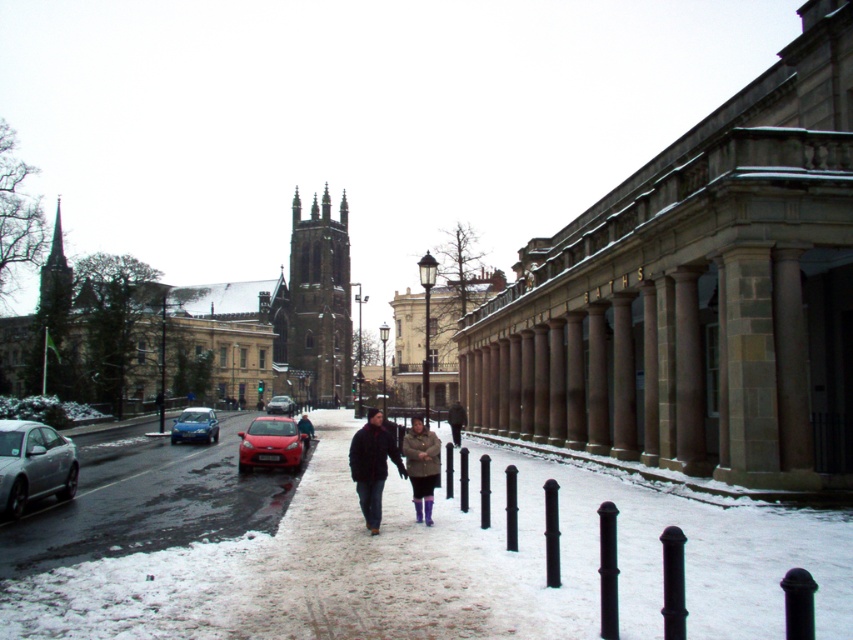
You are a delivery person who needs to place a package between the matte black jacket at center and the matte brown coat at center. The package requires a space of 5 meters. Can you fit the package between them?

The distance between the matte black jacket at center and the matte brown coat at center is 4.48 meters, which is less than the required 5 meters. Therefore, the package cannot be placed between them.

You are a photographer trying to capture both the matte black jacket at center and the matte brown coat at center in the same frame. Based on their positions, which one is more likely to be fully visible if you focus on the center of the image?

The matte black jacket at center is more likely to be fully visible because it is positioned at the center of the image, which is the focus point, whereas the matte brown coat at center may be partially obscured if it is wider and extends beyond the frame.